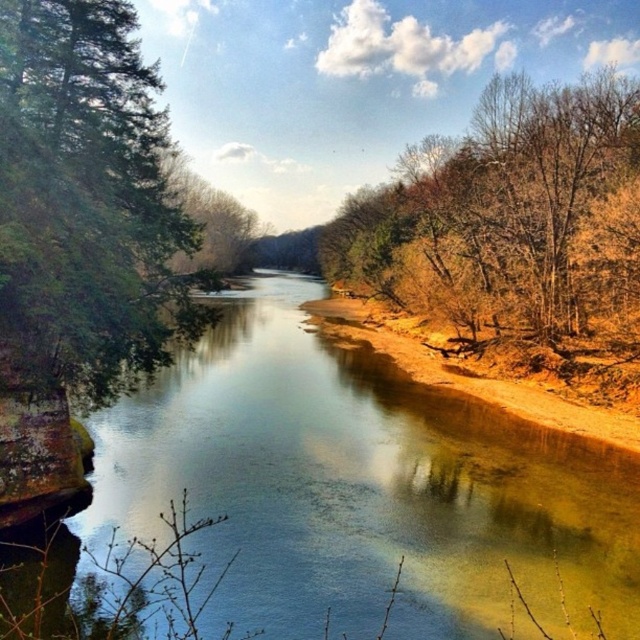
Question: Is clear water at center positioned at the back of brown leafy tree at right?

Choices:
 (A) yes
 (B) no

Answer: (B)

Question: Which of the following is the closest to the observer?

Choices:
 (A) (428, 195)
 (B) (134, 305)

Answer: (B)

Question: Does clear water at center appear over brown leafy tree at right?

Choices:
 (A) yes
 (B) no

Answer: (B)

Question: Which object appears farthest from the camera in this image?

Choices:
 (A) clear water at center
 (B) brown leafy tree at right
 (C) green textured tree at left

Answer: (B)

Question: Which point is farther to the camera?

Choices:
 (A) (52, 209)
 (B) (358, 540)
 (C) (589, 81)

Answer: (C)

Question: Does clear water at center lie behind brown leafy tree at right?

Choices:
 (A) yes
 (B) no

Answer: (B)